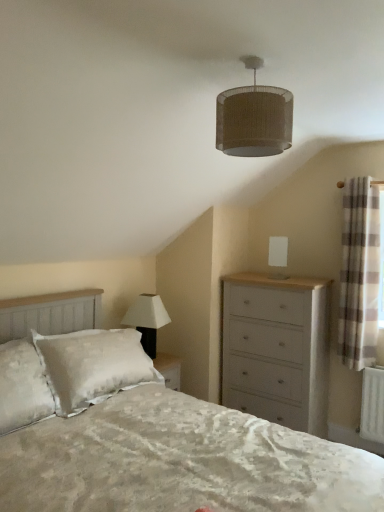
The height and width of the screenshot is (512, 384). Find the location of `free point above burlap-textured lampshade at upper center, which appears as the third lamp when viewed from the back (from a real-world perspective)`. free point above burlap-textured lampshade at upper center, which appears as the third lamp when viewed from the back (from a real-world perspective) is located at coordinates (268, 54).